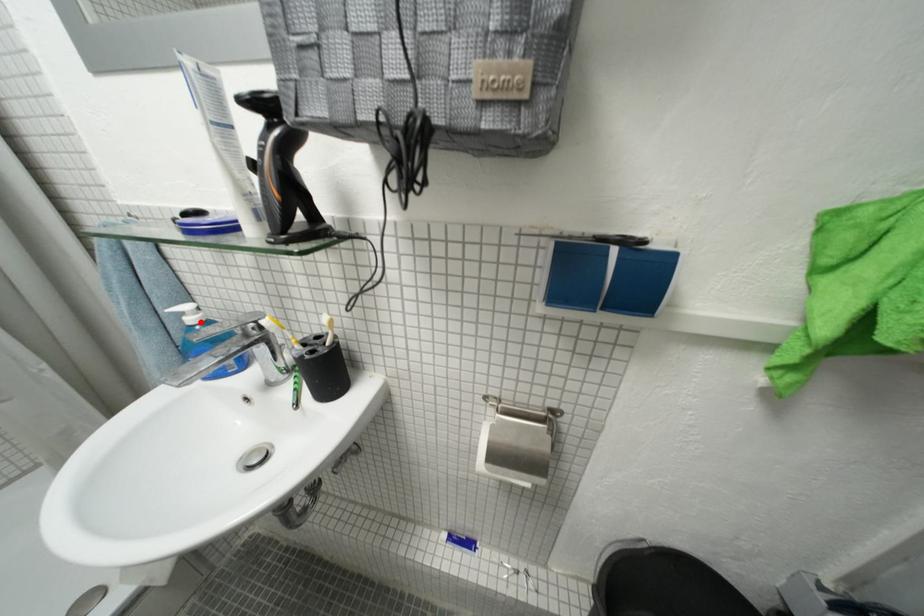
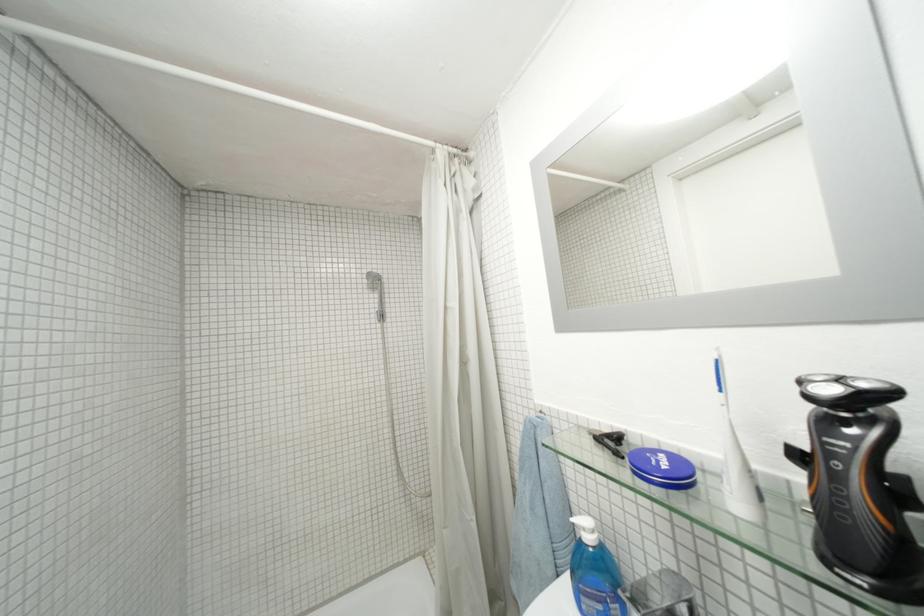
Locate, in the second image, the point that corresponds to the highlighted location in the first image.

(598, 541)